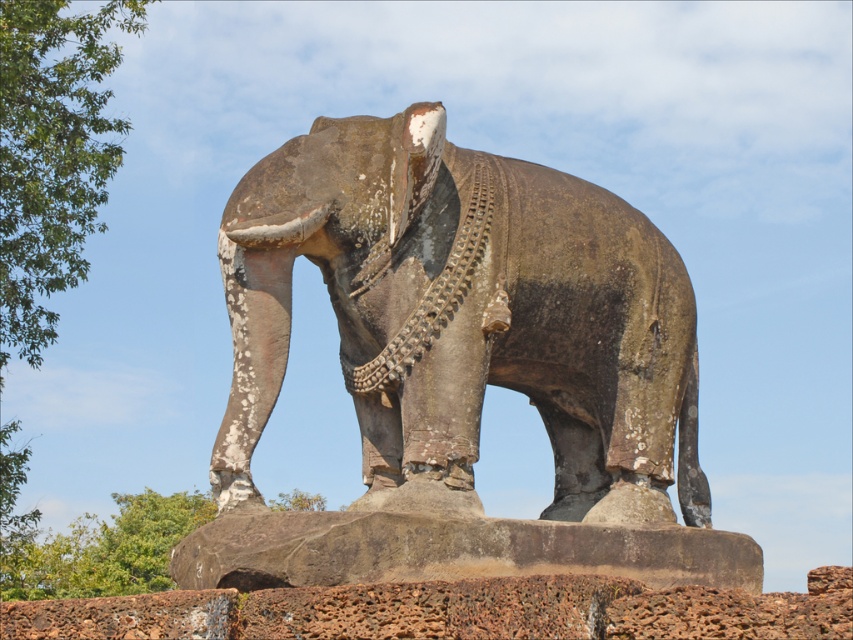
You are standing in front of a large stone statue of an elephant. A point at coordinates (x=463, y=317) is marked. What does this point indicate?

The point at coordinates (x=463, y=317) indicates the location of the rusty stone elephant at center.

You are standing in front of a large stone statue of an elephant positioned against a clear blue sky with scattered clouds. The statue has a dark brownish gray patina and stands on a weathered rectangular base. If you were to place a small bench exactly at coordinate point 0.5, 0.5, would the rusty stone elephant at center block the view of the bench from your current position?

The rusty stone elephant at center is located at point [463,317], which is very close to the bench at [426,320]. Depending on the size of the elephant statue, it might partially or fully block the view of the bench. However, since the bench is placed almost directly beneath the statue, the elephant could obstruct the view from your current position.